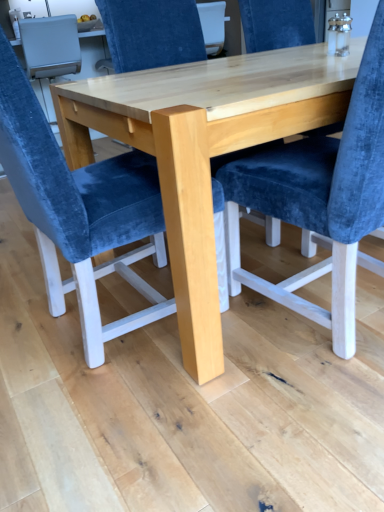
Question: Does point (182, 239) appear closer or farther from the camera than point (221, 258)?

Choices:
 (A) farther
 (B) closer

Answer: (B)

Question: Would you say natural wood table at center is inside or outside velvet blue chair at center, the second chair viewed from the front?

Choices:
 (A) inside
 (B) outside

Answer: (B)

Question: Based on their relative distances, which object is nearer to the natural wood table at center?

Choices:
 (A) velvet blue chair at center, placed as the first chair when sorted from front to back
 (B) velvet blue chair at center, the second chair viewed from the front

Answer: (A)

Question: Based on their relative distances, which object is nearer to the velvet blue chair at center, the 2th chair viewed from the back?

Choices:
 (A) natural wood table at center
 (B) velvet blue chair at center, the second chair viewed from the front

Answer: (A)